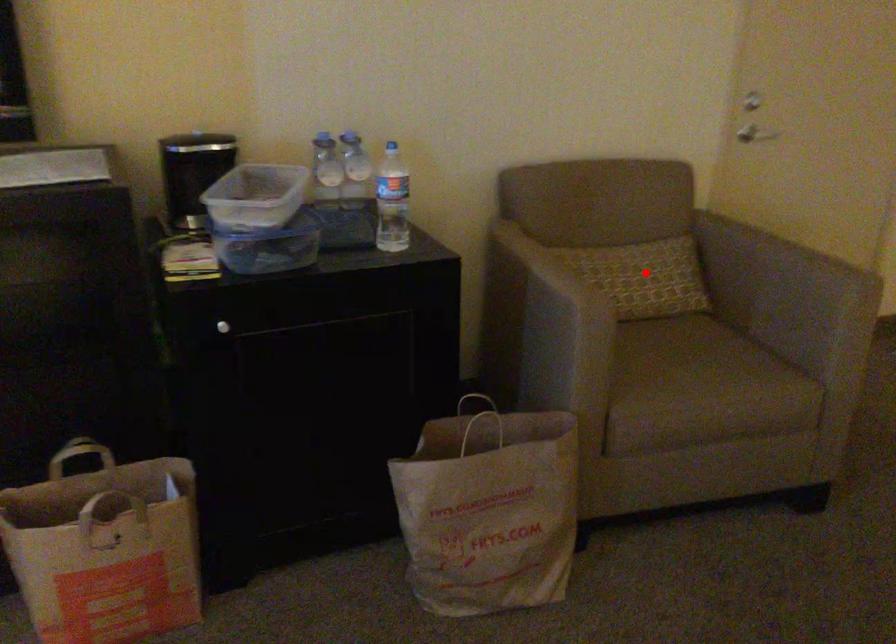
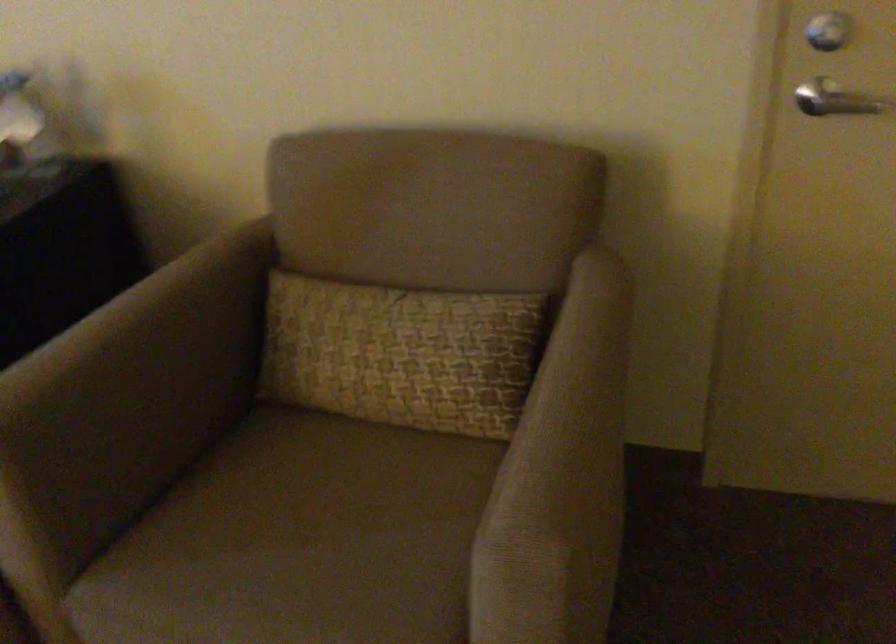
Question: A red point is marked in image1. In image2, is the corresponding 3D point closer to the camera or farther? Reply with the corresponding letter.

Choices:
 (A) The corresponding 3D point is closer.
 (B) The corresponding 3D point is farther.

Answer: (A)